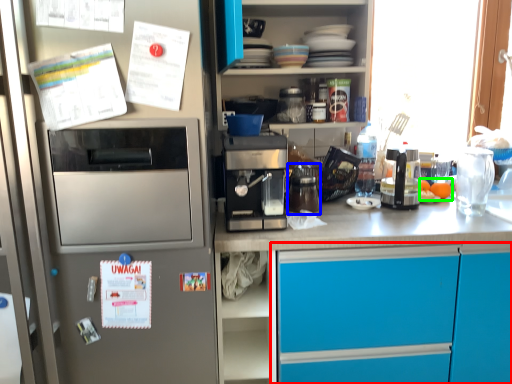
Question: Which object is positioned farthest from cabinetry (highlighted by a red box)? Select from appliance (highlighted by a blue box) and food (highlighted by a green box).

Choices:
 (A) appliance
 (B) food

Answer: (B)